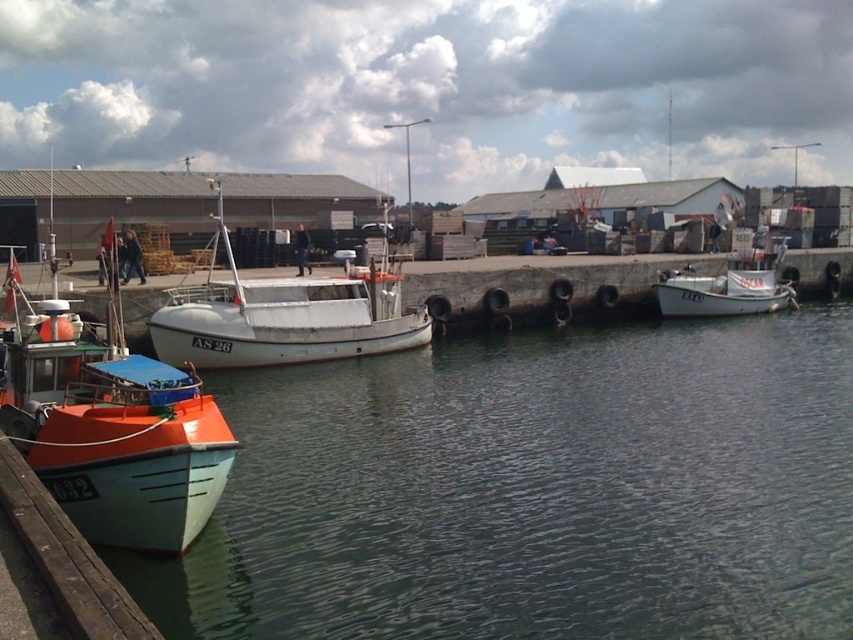
Question: Can you confirm if green matte water at lower left is smaller than white matte boat at center?

Choices:
 (A) yes
 (B) no

Answer: (A)

Question: Is the position of white matte boat at center less distant than that of white matte boat at right?

Choices:
 (A) yes
 (B) no

Answer: (A)

Question: Can you confirm if green matte water at lower left is wider than white matte boat at center?

Choices:
 (A) no
 (B) yes

Answer: (B)

Question: Based on their relative distances, which object is nearer to the orange matte boat at lower left?

Choices:
 (A) white matte boat at center
 (B) white matte boat at right
 (C) green matte water at lower left

Answer: (C)

Question: Which of the following is the farthest from the observer?

Choices:
 (A) (323, 276)
 (B) (722, 285)
 (C) (76, 401)
 (D) (527, 426)

Answer: (B)

Question: Which object appears closest to the camera in this image?

Choices:
 (A) white matte boat at right
 (B) white matte boat at center
 (C) orange matte boat at lower left
 (D) green matte water at lower left

Answer: (D)